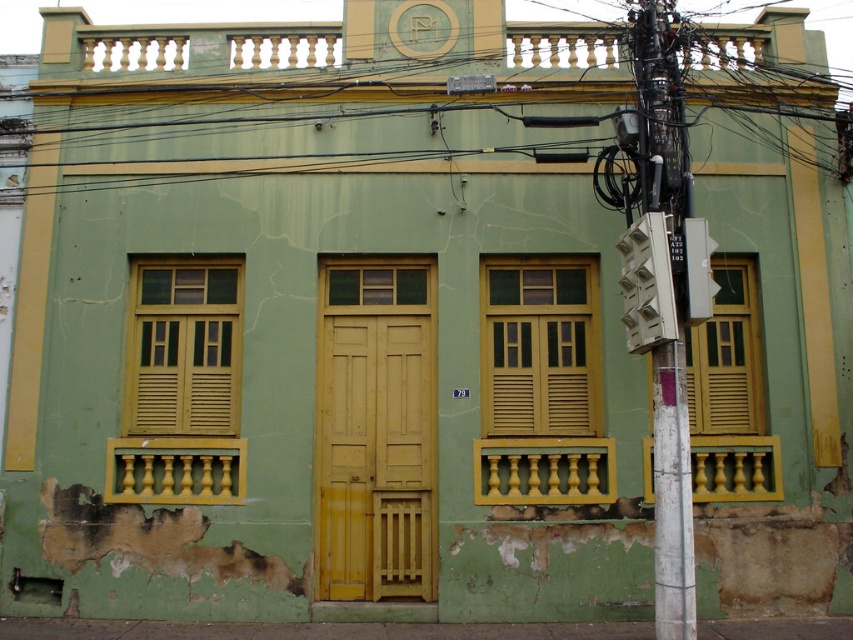
Is yellow matte door at center thinner than wooden at center?

No.

Based on the photo, between yellow matte door at center and wooden at center, which one is positioned higher?

Positioned higher is wooden at center.

You are a GUI agent. You are given a task and a screenshot of the screen. Output one action in this format:
    pyautogui.click(x=<x>, y=<y>)
    Task: Click on the yellow matte door at center
    The height and width of the screenshot is (640, 853).
    Given the screenshot: What is the action you would take?
    pyautogui.click(x=375, y=429)

Does wooden at center have a larger size compared to yellow matte shutter at right?

Yes.

Is point (523, 273) positioned before point (757, 372)?

That is False.

Where is `wooden at center`? wooden at center is located at coordinates (538, 346).

Is point (213, 403) farther from viewer compared to point (744, 364)?

That is False.

Measure the distance from wooden slatted shutters at left to yellow matte shutter at right.

The distance of wooden slatted shutters at left from yellow matte shutter at right is 5.14 meters.

The image size is (853, 640). What are the coordinates of `wooden slatted shutters at left` in the screenshot? It's located at (183, 348).